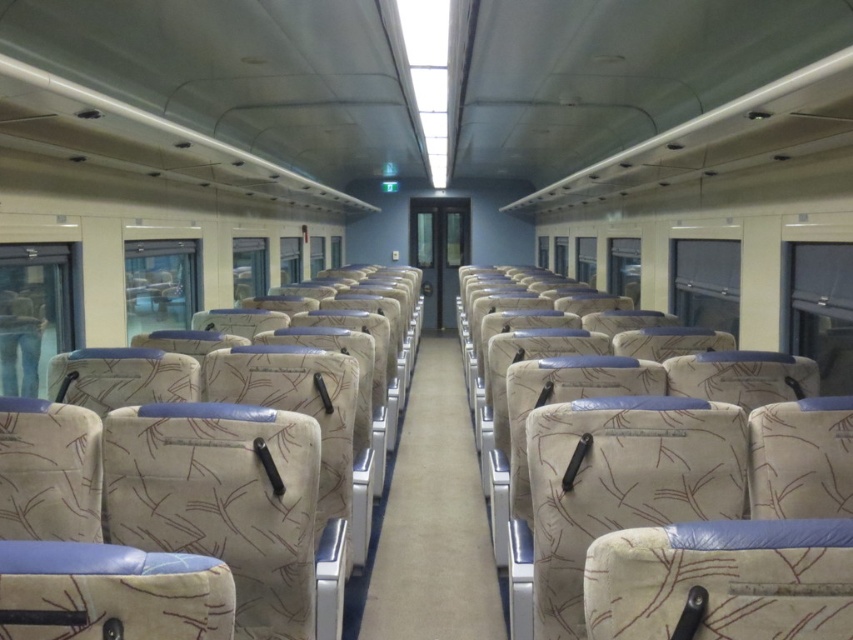
Between beige fabric aisle at center and denim jeans at left, which one appears on the left side from the viewer's perspective?

denim jeans at left is more to the left.

Between point (486, 547) and point (39, 314), which one is positioned behind?

Point (486, 547)

Does point (479, 628) lie behind point (27, 337)?

No, (479, 628) is in front of (27, 337).

The height and width of the screenshot is (640, 853). In order to click on beige fabric aisle at center in this screenshot , I will do `click(428, 522)`.